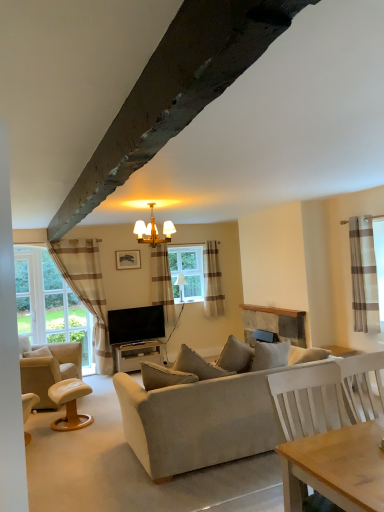
The width and height of the screenshot is (384, 512). Describe the element at coordinates (86, 290) in the screenshot. I see `beige striped curtain at left, arranged as the 2th curtain when viewed from the front` at that location.

This screenshot has width=384, height=512. Describe the element at coordinates (274, 322) in the screenshot. I see `stone fireplace at center` at that location.

What do you see at coordinates (187, 272) in the screenshot? The width and height of the screenshot is (384, 512). I see `clear glass window at center` at bounding box center [187, 272].

Measure the distance between point (212,257) and camera.

6.34 meters.

In order to click on light brown leather stool at lower left in this screenshot , I will do `click(70, 403)`.

You are a GUI agent. You are given a task and a screenshot of the screen. Output one action in this format:
    pyautogui.click(x=<x>, y=<y>)
    Task: Click on the beige fabric couch at center
    Image resolution: width=384 pixels, height=512 pixels.
    Given the screenshot: What is the action you would take?
    pyautogui.click(x=199, y=421)

Where is `beige striped curtain at left, arranged as the fourth curtain when viewed from the right`? This screenshot has width=384, height=512. beige striped curtain at left, arranged as the fourth curtain when viewed from the right is located at coordinates (86, 290).

Is wooden chandelier at center, positioned as the 1th lamp in front-to-back order, directly adjacent to matte gray table at center?

No, wooden chandelier at center, positioned as the 1th lamp in front-to-back order, is not making contact with matte gray table at center.

At what (x,y) coordinates should I click in order to perform the action: click on table behind the wooden chandelier at center, the 2th lamp when ordered from back to front. Please return your answer as a coordinate pair (x, y). The image size is (384, 512). Looking at the image, I should click on (135, 355).

From a real-world perspective, is wooden chandelier at center, positioned as the 1th lamp in front-to-back order, positioned over matte gray table at center based on gravity?

Indeed, from a real-world perspective, wooden chandelier at center, positioned as the 1th lamp in front-to-back order, stands above matte gray table at center.

Where is `fireplace below the white fabric lampshade at center, marked as the 2th lamp in a top-to-bottom arrangement (from the image's perspective)`? The width and height of the screenshot is (384, 512). fireplace below the white fabric lampshade at center, marked as the 2th lamp in a top-to-bottom arrangement (from the image's perspective) is located at coordinates (274, 322).

Which of these two, white fabric lampshade at center, the 1th lamp when ordered from bottom to top, or stone fireplace at center, is smaller?

white fabric lampshade at center, the 1th lamp when ordered from bottom to top, is smaller.

Is white fabric lampshade at center, marked as the 2th lamp in a top-to-bottom arrangement, spatially inside stone fireplace at center, or outside of it?

white fabric lampshade at center, marked as the 2th lamp in a top-to-bottom arrangement, lies outside stone fireplace at center.

Considering the sizes of objects white fabric lampshade at center, which is counted as the 2th lamp, starting from the front, and stone fireplace at center in the image provided, who is wider, white fabric lampshade at center, which is counted as the 2th lamp, starting from the front, or stone fireplace at center?

With larger width is white fabric lampshade at center, which is counted as the 2th lamp, starting from the front.

From a real-world perspective, is brown striped curtain at center, marked as the third curtain in a front-to-back arrangement, located beneath wooden chandelier at center, the 2th lamp when ordered from back to front?

Indeed, from a real-world perspective, brown striped curtain at center, marked as the third curtain in a front-to-back arrangement, is positioned beneath wooden chandelier at center, the 2th lamp when ordered from back to front.

Could you tell me if brown striped curtain at center, the second curtain from the back, is facing wooden chandelier at center, placed as the second lamp when sorted from bottom to top?

No.

Identify the location of lamp that is the 1st object to the right of the brown striped curtain at center, the second curtain from the back, starting at the anchor. Image resolution: width=384 pixels, height=512 pixels. (153, 231).

Looking at this image, is the surface of wooden picture frame at upper center in direct contact with beige striped curtain at left?

No, wooden picture frame at upper center is not making contact with beige striped curtain at left.

Which object is positioned more to the left, wooden picture frame at upper center or beige striped curtain at left?

From the viewer's perspective, beige striped curtain at left appears more on the left side.

From a real-world perspective, who is located lower, wooden picture frame at upper center or beige striped curtain at left?

beige striped curtain at left, from a real-world perspective.

Which is behind, wooden picture frame at upper center or beige striped curtain at left?

wooden picture frame at upper center is further from the camera.

Is clear glass window at center thinner than beige leather chair at left?

Yes, clear glass window at center is thinner than beige leather chair at left.

Locate an element on the screen. window to the right of beige leather chair at left is located at coordinates (187, 272).

Is clear glass window at center positioned behind beige leather chair at left?

Yes, clear glass window at center is behind beige leather chair at left.

Is clear glass window at center positioned far away from beige leather chair at left?

Yes.

In terms of height, does brown striped fabric curtain at right, positioned as the 1th curtain in right-to-left order, look taller or shorter compared to beige leather chair at left?

In the image, brown striped fabric curtain at right, positioned as the 1th curtain in right-to-left order, appears to be taller than beige leather chair at left.

Which point is more forward, (362, 282) or (66, 357)?

Point (362, 282)

From a real-world perspective, who is located lower, brown striped fabric curtain at right, positioned as the 1th curtain in right-to-left order, or beige leather chair at left?

beige leather chair at left, from a real-world perspective.

Which object is more forward, beige striped curtain at center, positioned as the 1th curtain in back-to-front order, or beige striped curtain at left, arranged as the 2th curtain when viewed from the front?

beige striped curtain at left, arranged as the 2th curtain when viewed from the front, is closer to the camera.

Between point (218, 302) and point (101, 364), which one is positioned in front?

The point (218, 302) is closer.

Is there a large distance between beige striped curtain at center, which is the 3th curtain from left to right, and beige striped curtain at left, arranged as the fourth curtain when viewed from the right?

Yes.

The width and height of the screenshot is (384, 512). Identify the location of table below the wooden chandelier at center, the 2th lamp when ordered from back to front (from a real-world perspective). (135, 355).

The width and height of the screenshot is (384, 512). I want to click on fireplace below the white fabric lampshade at center, marked as the 2th lamp in a top-to-bottom arrangement (from the image's perspective), so click(274, 322).

Considering their positions, is beige striped curtain at center, the fourth curtain viewed from the front, positioned closer to white fabric lampshade at center, which is counted as the 2th lamp, starting from the front, than beige striped curtain at left?

Based on the image, beige striped curtain at center, the fourth curtain viewed from the front, appears to be nearer to white fabric lampshade at center, which is counted as the 2th lamp, starting from the front.

Based on their spatial positions, is flat screen tv at center or beige leather chair at left further from beige striped curtain at left?

beige leather chair at left is positioned further to the anchor beige striped curtain at left.

When comparing their distances from clear glass window at center, does beige striped curtain at left, which is counted as the first curtain, starting from the left, or wooden chandelier at center, the 2th lamp when ordered from back to front, seem closer?

beige striped curtain at left, which is counted as the first curtain, starting from the left, is positioned closer to the anchor clear glass window at center.

From the image, which object appears to be farther from beige striped curtain at left, arranged as the fourth curtain when viewed from the right, beige striped curtain at left or beige striped curtain at center, which is the 3th curtain from left to right?

Among the two, beige striped curtain at center, which is the 3th curtain from left to right, is located further to beige striped curtain at left, arranged as the fourth curtain when viewed from the right.

Looking at the image, which one is located further to beige striped curtain at center, which is the 3th curtain from left to right, beige striped curtain at left or white fabric lampshade at center, which is counted as the 2th lamp, starting from the front?

The object further to beige striped curtain at center, which is the 3th curtain from left to right, is beige striped curtain at left.

When comparing their distances from beige leather chair at left, does clear glass window at center or brown striped curtain at center, marked as the third curtain in a front-to-back arrangement, seem further?

Based on the image, clear glass window at center appears to be further to beige leather chair at left.

Which object lies further to the anchor point beige striped curtain at left, beige striped curtain at center, which is the 3th curtain from left to right, or wooden chandelier at center, the 2th lamp when ordered from back to front?

beige striped curtain at center, which is the 3th curtain from left to right.

From the picture: From the image, which object appears to be farther from beige fabric couch at center, beige striped curtain at left, the third curtain in the back-to-front sequence, or brown striped fabric curtain at right, positioned as the 1th curtain in right-to-left order?

beige striped curtain at left, the third curtain in the back-to-front sequence.

Locate an element on the screen. This screenshot has width=384, height=512. bay window between light brown leather stool at lower left and white fabric lampshade at center, which is counted as the 2th lamp, starting from the front, from front to back is located at coordinates (49, 304).

At what (x,y) coordinates should I click in order to perform the action: click on lamp between light brown leather stool at lower left and wooden picture frame at upper center from front to back. Please return your answer as a coordinate pair (x, y). This screenshot has height=512, width=384. Looking at the image, I should click on (153, 231).

This screenshot has width=384, height=512. What are the coordinates of `television between light brown leather stool at lower left and clear glass window at center in the front-back direction` in the screenshot? It's located at (136, 324).

This screenshot has width=384, height=512. Identify the location of television between light brown leather stool at lower left and white fabric lampshade at center, placed as the 1th lamp when sorted from back to front, from front to back. (136, 324).